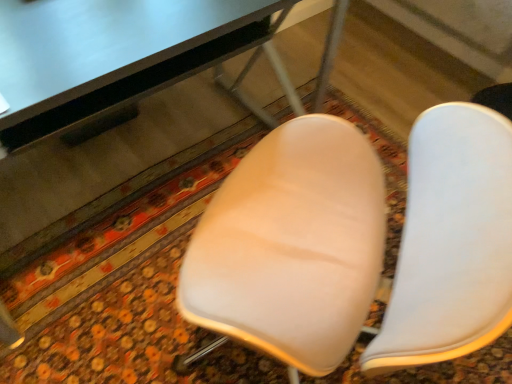
You are a GUI agent. You are given a task and a screenshot of the screen. Output one action in this format:
    pyautogui.click(x=<x>, y=<y>)
    Task: Click on the vacant space underneath matte black table at upper center (from a real-world perspective)
    
    Given the screenshot: What is the action you would take?
    pyautogui.click(x=115, y=160)